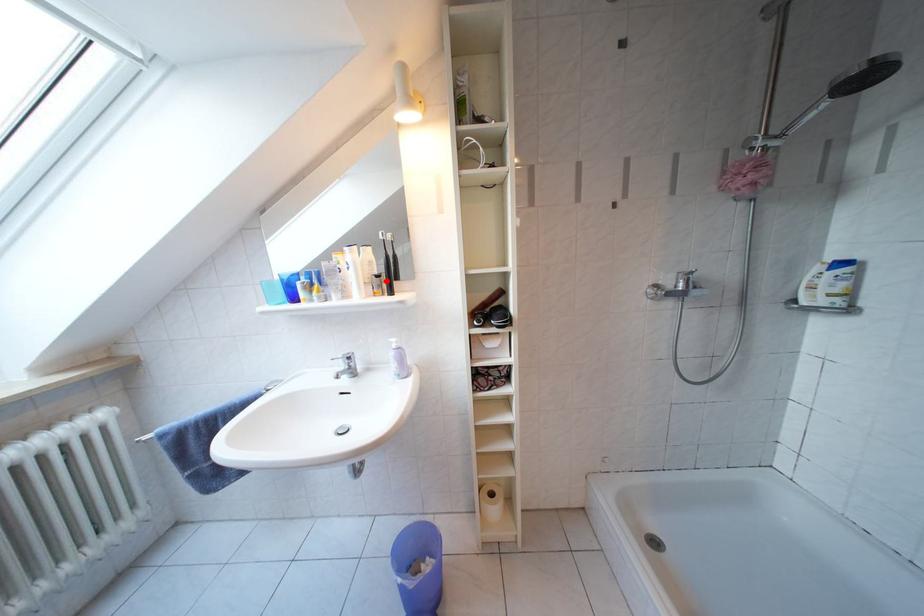
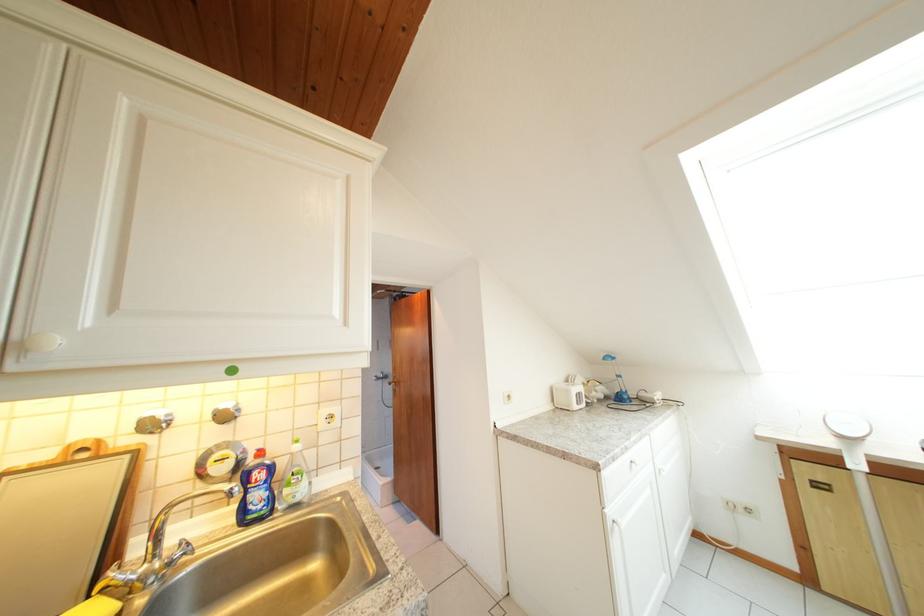
Question: I am providing you with two images of the same scene from different viewpoints. A red point is marked on the first image. At the location where the point appears in image 1, is it still visible in image 2?

Choices:
 (A) Yes
 (B) No

Answer: (B)